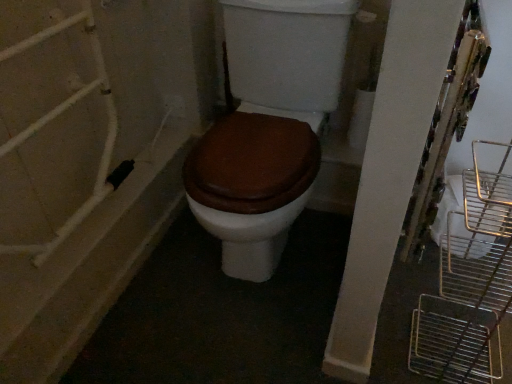
Question: From the image's perspective, is brown matte toilet at center on black plastic plug at lower left?

Choices:
 (A) no
 (B) yes

Answer: (B)

Question: Is brown matte toilet at center shorter than black plastic plug at lower left?

Choices:
 (A) yes
 (B) no

Answer: (B)

Question: Does brown matte toilet at center have a greater height compared to black plastic plug at lower left?

Choices:
 (A) yes
 (B) no

Answer: (A)

Question: Is brown matte toilet at center outside black plastic plug at lower left?

Choices:
 (A) yes
 (B) no

Answer: (A)

Question: Are brown matte toilet at center and black plastic plug at lower left located far from each other?

Choices:
 (A) yes
 (B) no

Answer: (B)

Question: Is brown matte toilet at center thinner than black plastic plug at lower left?

Choices:
 (A) yes
 (B) no

Answer: (A)

Question: Does black plastic plug at lower left have a lesser height compared to brown matte toilet at center?

Choices:
 (A) yes
 (B) no

Answer: (A)

Question: Is black plastic plug at lower left positioned with its back to brown matte toilet at center?

Choices:
 (A) no
 (B) yes

Answer: (A)

Question: Considering the relative positions of black plastic plug at lower left and brown matte toilet at center in the image provided, is black plastic plug at lower left to the left of brown matte toilet at center from the viewer's perspective?

Choices:
 (A) yes
 (B) no

Answer: (A)

Question: Would you say brown matte toilet at center is part of black plastic plug at lower left's contents?

Choices:
 (A) yes
 (B) no

Answer: (B)

Question: Is black plastic plug at lower left oriented towards brown matte toilet at center?

Choices:
 (A) no
 (B) yes

Answer: (A)

Question: Can you confirm if black plastic plug at lower left is bigger than brown matte toilet at center?

Choices:
 (A) no
 (B) yes

Answer: (A)

Question: Is brown matte toilet at center in front of or behind black plastic plug at lower left in the image?

Choices:
 (A) behind
 (B) front

Answer: (B)